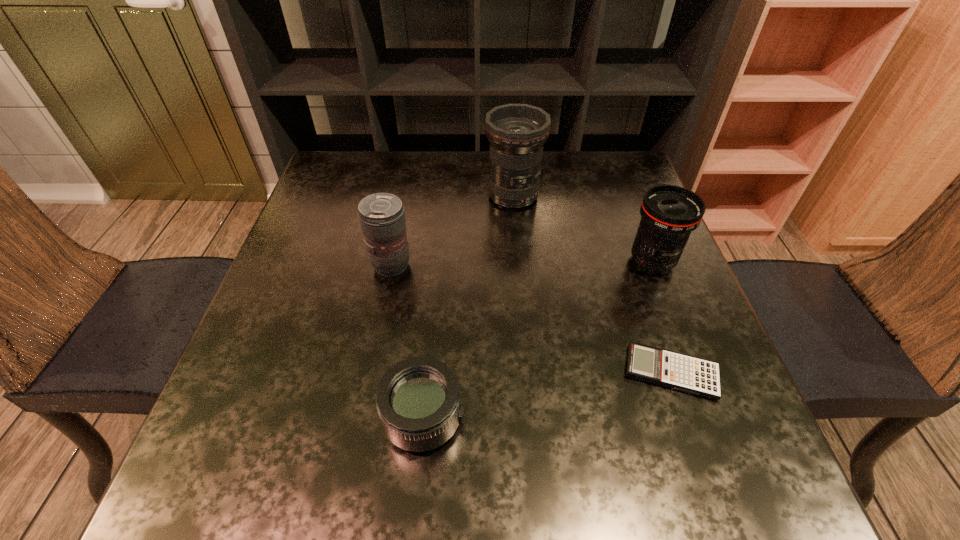
What are the coordinates of `object present at the far edge` in the screenshot? It's located at (517, 132).

Locate an element on the screen. This screenshot has height=540, width=960. object that is at the near edge is located at coordinates (418, 400).

I want to click on telephoto lens at the right edge, so point(670,213).

Locate an element on the screen. The width and height of the screenshot is (960, 540). calculator positioned at the right edge is located at coordinates (696, 376).

Image resolution: width=960 pixels, height=540 pixels. Find the location of `free space at the far edge`. free space at the far edge is located at coordinates (438, 189).

I want to click on free space at the near edge of the desktop, so click(x=470, y=466).

This screenshot has width=960, height=540. I want to click on vacant space at the left edge of the desktop, so click(324, 342).

Find the location of `vacant space at the right edge of the desktop`. vacant space at the right edge of the desktop is located at coordinates (657, 296).

At what (x,y) coordinates should I click in order to perform the action: click on free region at the far left corner of the desktop. Please return your answer as a coordinate pair (x, y). Image resolution: width=960 pixels, height=540 pixels. Looking at the image, I should click on (379, 175).

Where is `vacant space at the near left corner of the desktop`? Image resolution: width=960 pixels, height=540 pixels. vacant space at the near left corner of the desktop is located at coordinates (245, 448).